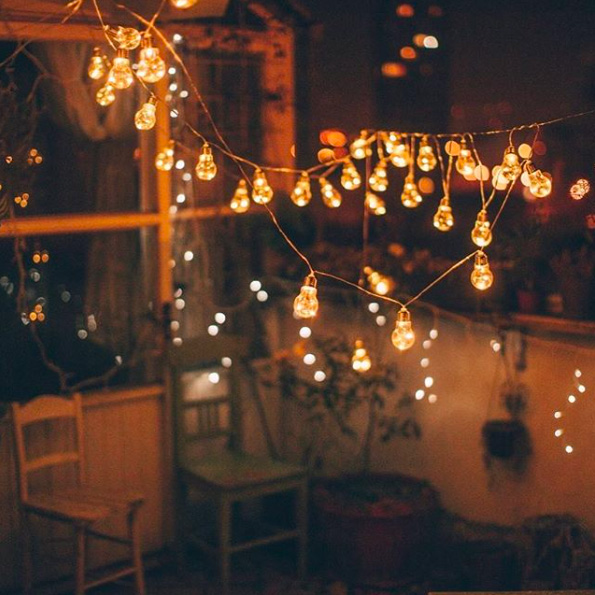
Where is `plant`? plant is located at coordinates click(x=334, y=387), click(x=519, y=436).